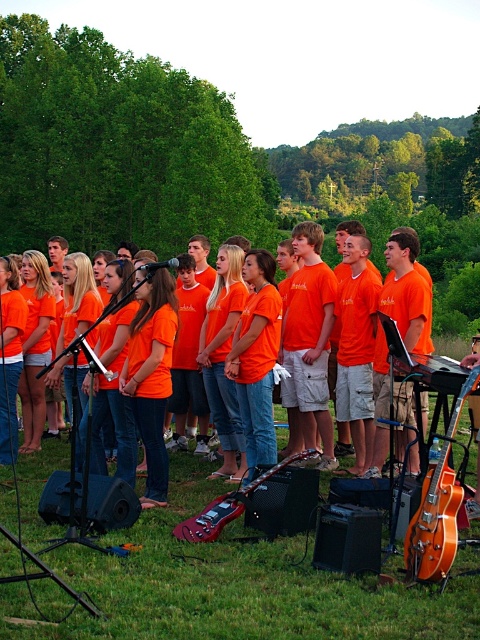
Can you confirm if orange cotton shirt at center is positioned above glossy red electric guitar at lower center?

Yes.

Can you confirm if orange cotton shirt at center is taller than glossy red electric guitar at lower center?

Correct, orange cotton shirt at center is much taller as glossy red electric guitar at lower center.

This screenshot has height=640, width=480. What do you see at coordinates (350, 321) in the screenshot? I see `orange cotton shirt at center` at bounding box center [350, 321].

Locate an element on the screen. The width and height of the screenshot is (480, 640). orange cotton shirt at center is located at coordinates (350, 321).

Can you confirm if orange cotton shirt at center is positioned to the right of glossy wood guitar at right?

No, orange cotton shirt at center is not to the right of glossy wood guitar at right.

Does orange cotton shirt at center appear over glossy wood guitar at right?

Yes, orange cotton shirt at center is above glossy wood guitar at right.

Does point (381, 305) lie in front of point (407, 376)?

No.

This screenshot has width=480, height=640. Identify the location of orange cotton shirt at center. (x=350, y=321).

Is orange cotton shirt at center taller than orange wood electric guitar at lower right?

Indeed, orange cotton shirt at center has a greater height compared to orange wood electric guitar at lower right.

In the scene shown: Is orange cotton shirt at center above orange wood electric guitar at lower right?

Indeed, orange cotton shirt at center is positioned over orange wood electric guitar at lower right.

This screenshot has height=640, width=480. Describe the element at coordinates (350, 321) in the screenshot. I see `orange cotton shirt at center` at that location.

Where is `orange cotton shirt at center`? orange cotton shirt at center is located at coordinates (350, 321).